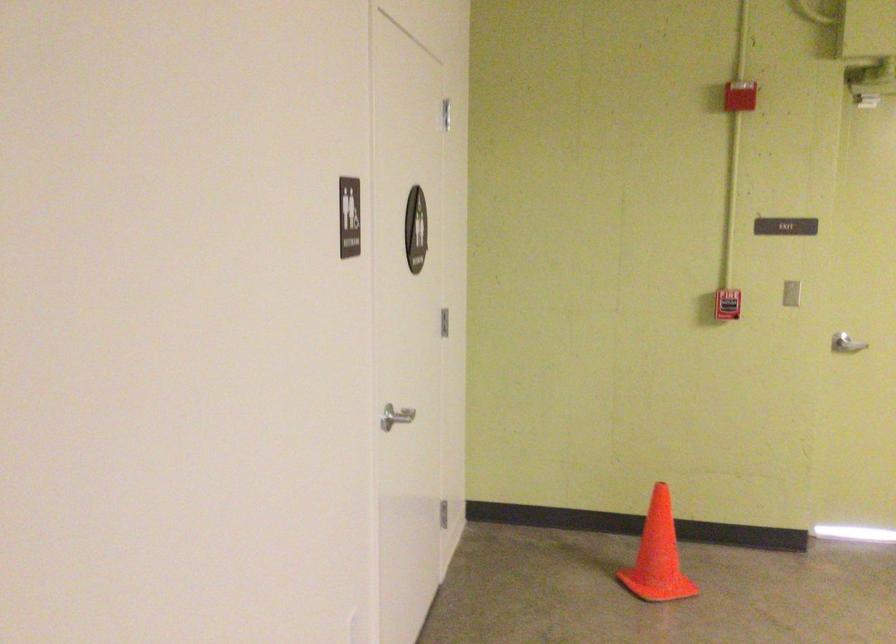
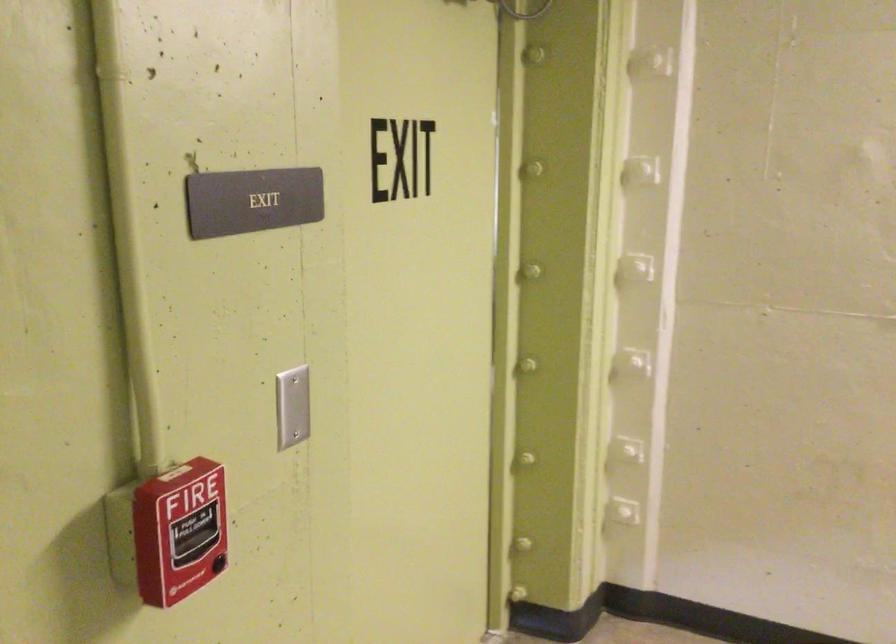
The point at (737, 310) is marked in the first image. Where is the corresponding point in the second image?

(179, 532)